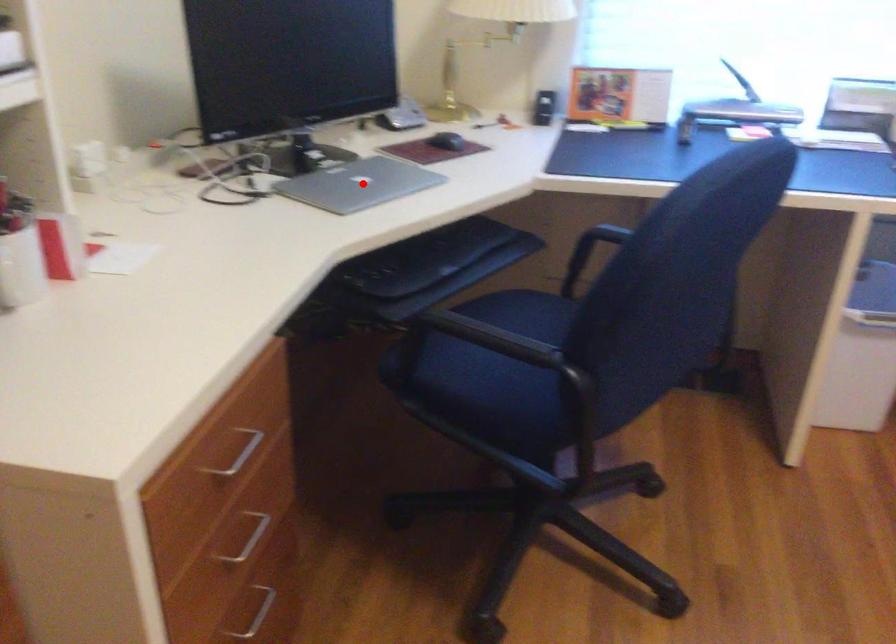
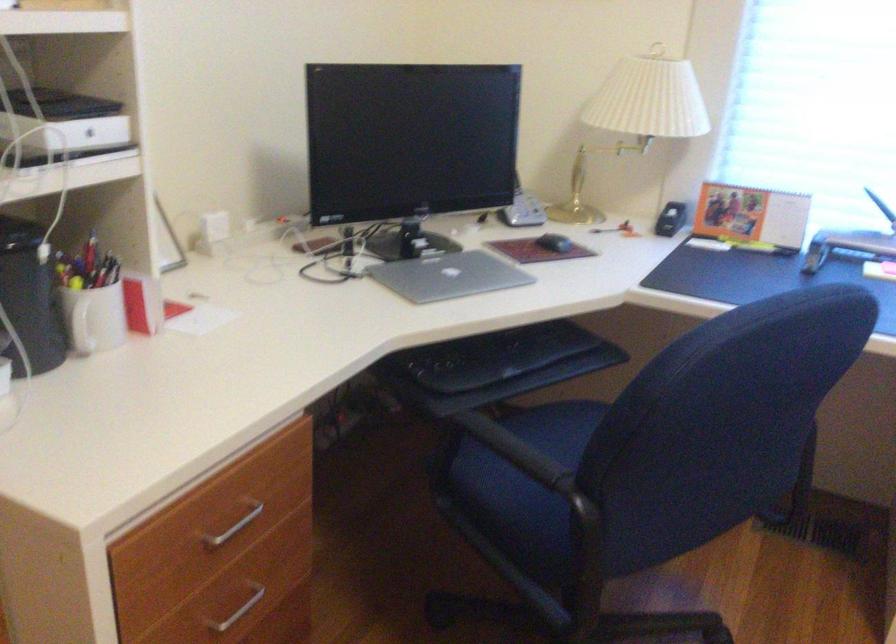
In the second image, find the point that corresponds to the highlighted location in the first image.

(449, 276)